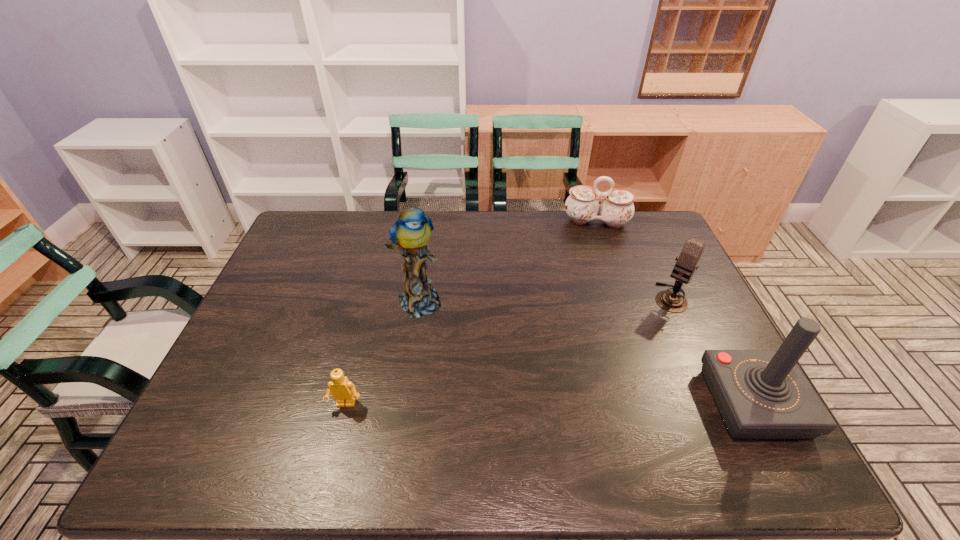
This screenshot has width=960, height=540. I want to click on blank region between the shortest object and the parrot, so click(382, 352).

Identify the location of free spot between the chinaware and the third shortest object. (634, 260).

In order to click on vacant point located between the parrot and the chinaware in this screenshot , I will do `click(508, 261)`.

Where is `vacant region between the microphone and the fourth object from right to left`? The width and height of the screenshot is (960, 540). vacant region between the microphone and the fourth object from right to left is located at coordinates (544, 299).

Locate an element on the screen. The image size is (960, 540). vacant space that's between the leftmost object and the second tallest object is located at coordinates (550, 404).

Locate an element on the screen. The width and height of the screenshot is (960, 540). vacant space that's between the second tallest object and the Lego is located at coordinates (550, 404).

Locate an element on the screen. The image size is (960, 540). vacant space that's between the shortest object and the parrot is located at coordinates [x=382, y=352].

You are a GUI agent. You are given a task and a screenshot of the screen. Output one action in this format:
    pyautogui.click(x=<x>, y=<y>)
    Task: Click on the object that stands as the third closest to the fourth object from right to left
    Image resolution: width=960 pixels, height=540 pixels.
    Given the screenshot: What is the action you would take?
    pyautogui.click(x=672, y=301)

Locate an element on the screen. This screenshot has height=540, width=960. object identified as the fourth closest to the leftmost object is located at coordinates (582, 206).

The width and height of the screenshot is (960, 540). I want to click on vacant position in the image that satisfies the following two spatial constraints: 1. on the back side of the chinaware; 2. on the left side of the tallest object, so click(x=430, y=222).